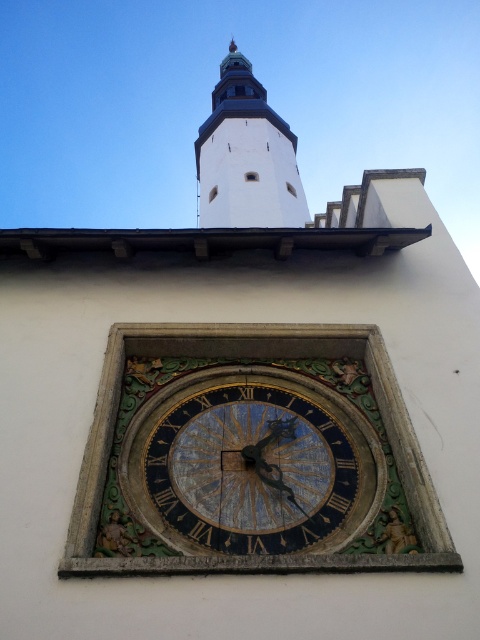
Question: Which point is farther to the camera?

Choices:
 (A) white stone bell tower at upper center
 (B) gold textured clock at center

Answer: (A)

Question: Among these points, which one is farthest from the camera?

Choices:
 (A) (235, 397)
 (B) (264, 225)

Answer: (B)

Question: Does gold textured clock at center have a larger size compared to white stone bell tower at upper center?

Choices:
 (A) no
 (B) yes

Answer: (A)

Question: Is gold textured clock at center thinner than white stone bell tower at upper center?

Choices:
 (A) yes
 (B) no

Answer: (A)

Question: Among these points, which one is farthest from the camera?

Choices:
 (A) (133, 493)
 (B) (266, 193)

Answer: (B)

Question: Does gold textured clock at center lie behind white stone bell tower at upper center?

Choices:
 (A) no
 (B) yes

Answer: (A)